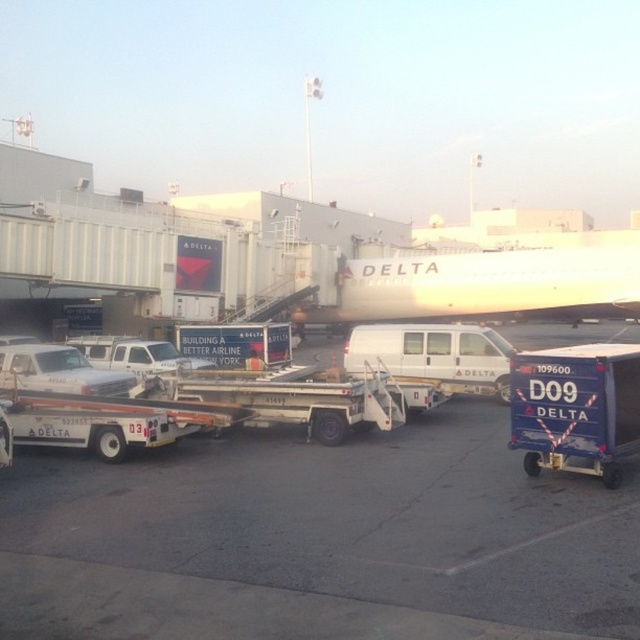
You are a pilot preparing for takeoff and need to ensure there is enough space between the white asphalt tarmac at center and the white glossy airplane at upper center. Based on the scene, can you determine if the tarmac is longer than the airplane?

The white asphalt tarmac at center is shorter than the white glossy airplane at upper center, so the tarmac is not longer than the airplane.

You are a drone operator tasked with landing a drone on the white asphalt tarmac at center. According to the coordinates provided, where exactly should you aim the drone to ensure a safe landing?

The white asphalt tarmac at center is located at point (317,540), so you should aim the drone at those coordinates for a safe landing.